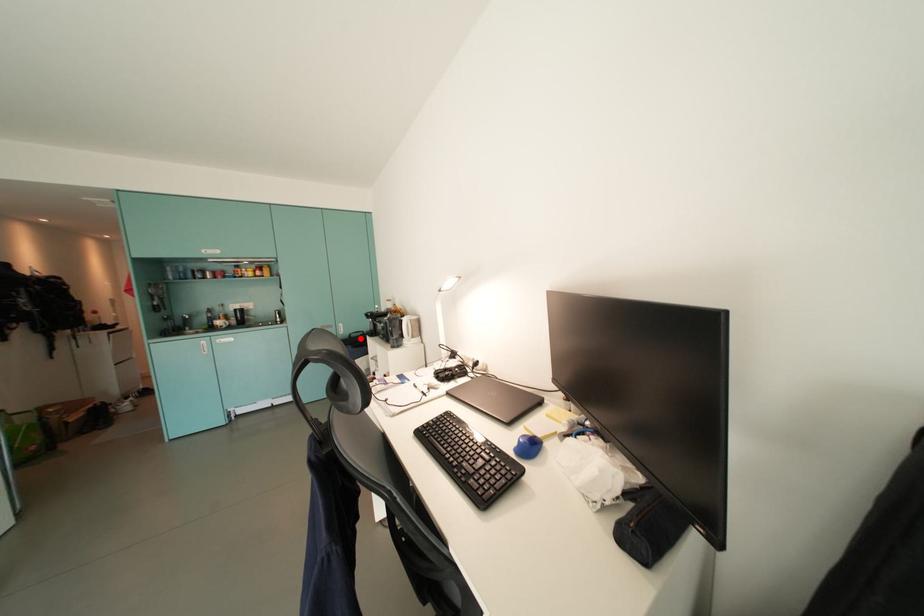
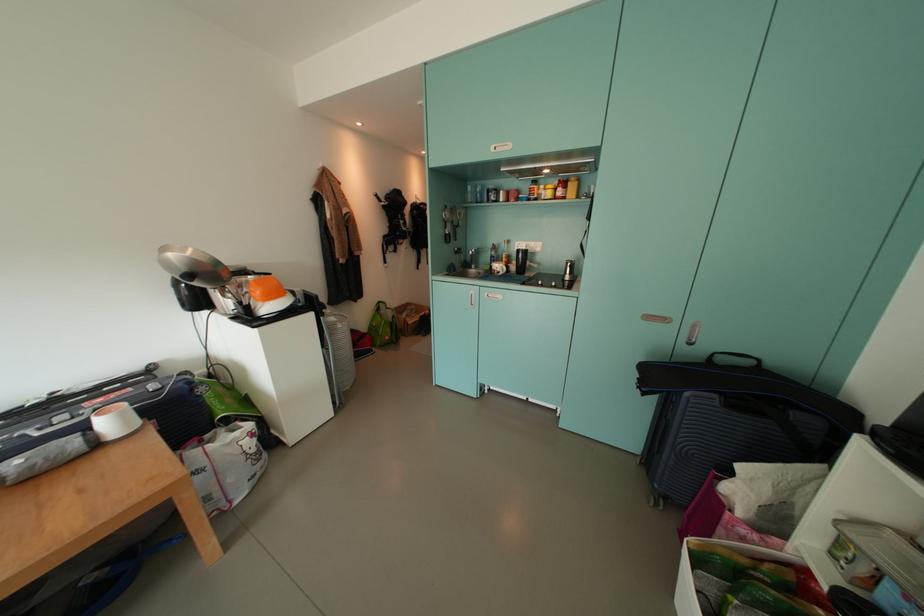
Question: I am providing you with two images of the same scene from different viewpoints. In image1, a red point is highlighted. Considering the same 3D point in image2, which of the following is correct?

Choices:
 (A) It is closer
 (B) It is farther

Answer: (A)